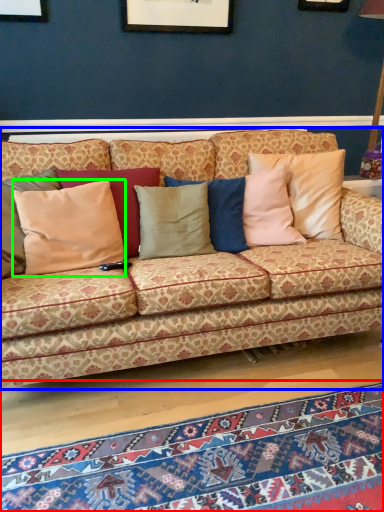
Question: Which object is positioned closest to mat (highlighted by a red box)? Select from studio couch (highlighted by a blue box) and pillow (highlighted by a green box).

Choices:
 (A) studio couch
 (B) pillow

Answer: (A)